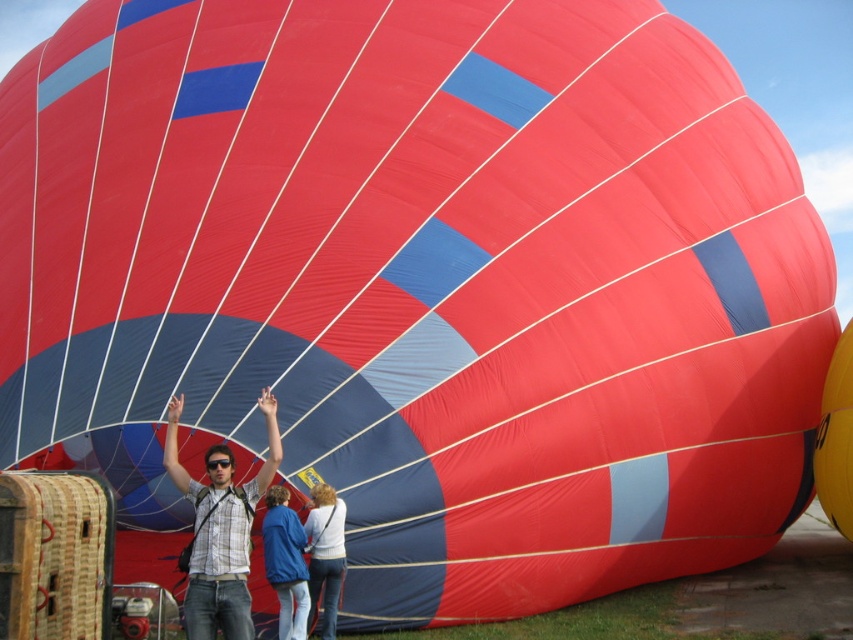
Based on the photo, you are a photographer trying to capture a photo of the yellow matte balloon at center. There is a person in a matte plaid shirt at center blocking your view. Can you move to the right to get a clear shot of the balloon?

The matte plaid shirt at center is positioned on the left side of the yellow matte balloon at center. Moving to the right would allow you to avoid the person and capture the balloon without obstruction.

You are standing in front of the yellow matte balloon at center and want to wave to the person wearing the matte plaid shirt at center. Since both are at center, can you directly see and wave to them without any obstruction?

The matte plaid shirt at center is closer to the viewer than the yellow matte balloon at center, so you can directly see and wave to the person wearing the matte plaid shirt at center without any obstruction.

You are planning to take a photo of the yellow matte balloon at center and the white sweater at center. Which object should you zoom in on to capture more details without moving the camera?

The yellow matte balloon at center has a smaller width than the white sweater at center, so you should zoom in on the yellow matte balloon at center to capture more details without moving the camera.